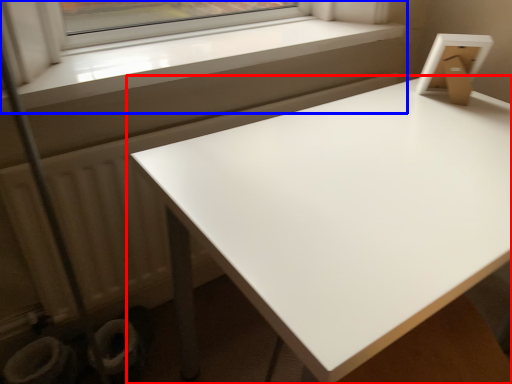
Question: Which object appears farthest to the camera in this image, table (highlighted by a red box) or window (highlighted by a blue box)?

Choices:
 (A) table
 (B) window

Answer: (B)